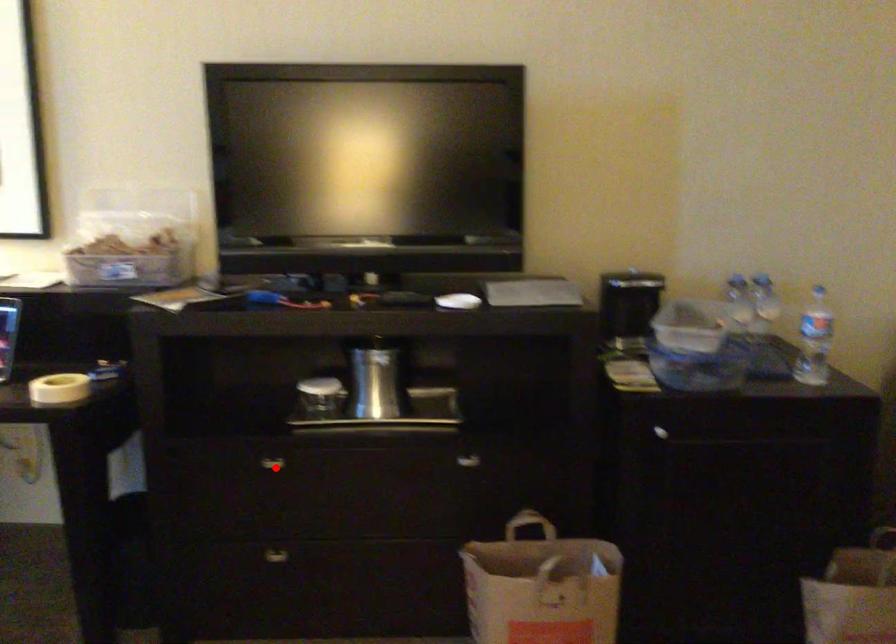
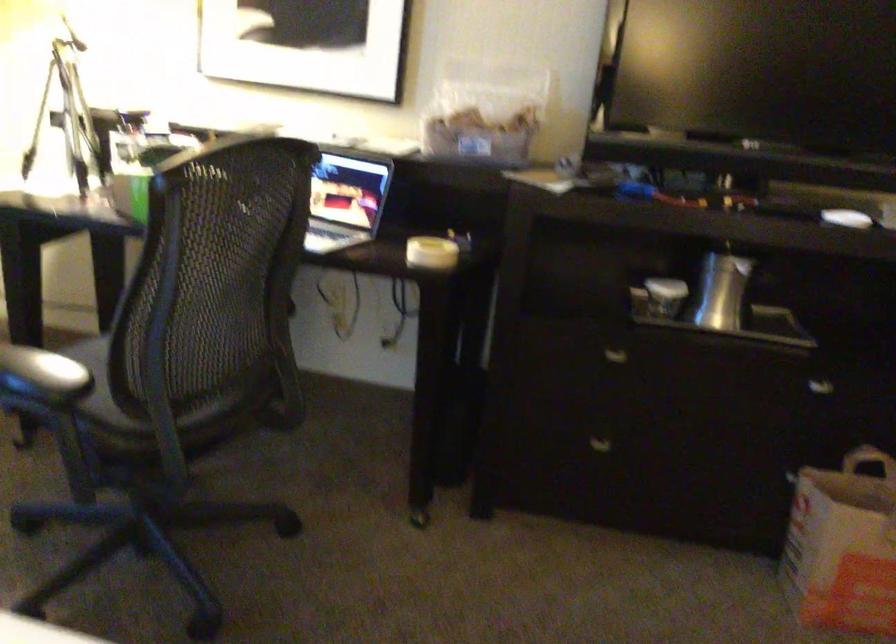
Question: I am providing you with two images of the same scene from different viewpoints. A red point is marked on the first image. Is the red point's position out of view in image 2?

Choices:
 (A) Yes
 (B) No

Answer: (B)